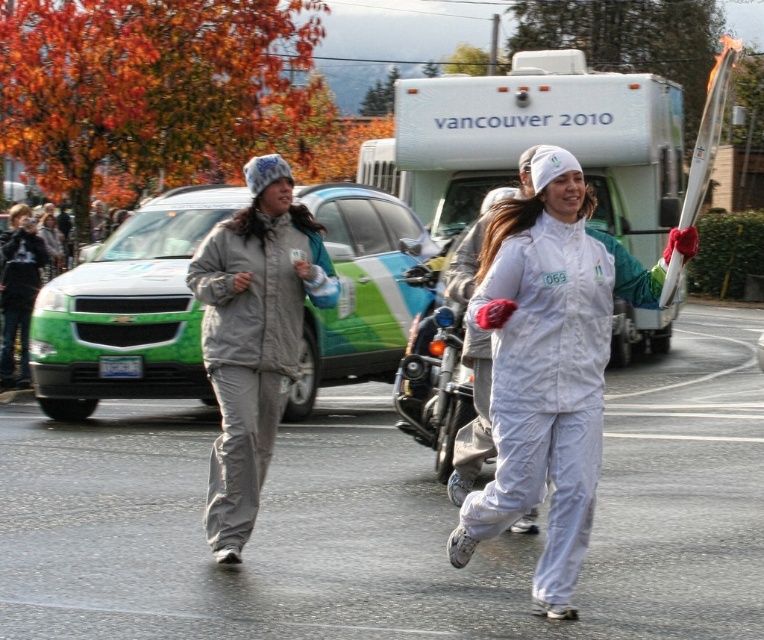
You are a delivery person who needs to place a gray fleece jacket at left and a shiny chrome motorcycle at center in a warehouse. The minimum required distance between stored items is 1.5 meters for safety. Based on the image, can you safely store them at their current positions?

The gray fleece jacket at left and shiny chrome motorcycle at center are 1.33 meters apart, which is less than the required 1.5 meters for safety. Therefore, they cannot be safely stored at their current positions and need to be rearranged to meet the distance requirement.

You are a photographer at the event and need to capture both the gray fleece jacket at left and the shiny chrome motorcycle at center in a single frame. Based on their sizes, which object should you focus on first to ensure both are in the frame?

The gray fleece jacket at left is taller than the shiny chrome motorcycle at center, so you should focus on the gray fleece jacket at left first to ensure both fit within the frame.

You are a photographer positioned at the starting line of the relay event. You need to capture a photo that includes both the gray fleece jacket at left and the shiny chrome motorcycle at center. Based on their positions, which object should you adjust your camera angle to include first?

The gray fleece jacket at left is to the left of the shiny chrome motorcycle at center, so you should adjust your camera angle to include the gray fleece jacket at left first since it is positioned further to the left side of the frame.